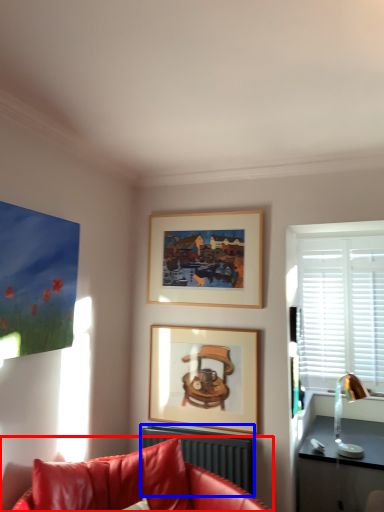
Question: Which object is further to the camera taking this photo, studio couch (highlighted by a red box) or radiator (highlighted by a blue box)?

Choices:
 (A) studio couch
 (B) radiator

Answer: (B)